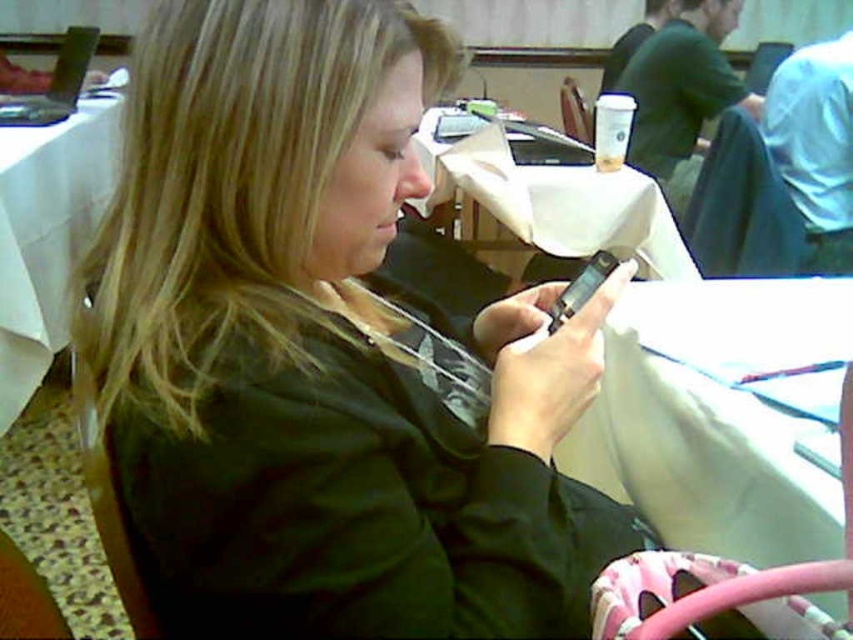
Question: Can you confirm if white cloth at left is positioned above white paper at center?

Choices:
 (A) yes
 (B) no

Answer: (B)

Question: Does matte black phone at center appear under white cloth at left?

Choices:
 (A) yes
 (B) no

Answer: (A)

Question: Which object is positioned farthest from the white fabric table at lower right?

Choices:
 (A) matte black phone at center
 (B) white paper at center
 (C) wooden chair at center
 (D) white cloth at left

Answer: (C)

Question: Can you confirm if matte black phone at center is positioned to the right of blue fabric chair at upper right?

Choices:
 (A) yes
 (B) no

Answer: (B)

Question: Which is farther from the wooden chair at center?

Choices:
 (A) white paper at center
 (B) blue fabric chair at upper right

Answer: (A)

Question: Considering the real-world distances, which object is closest to the white cloth at left?

Choices:
 (A) white paper at center
 (B) blue fabric chair at upper right
 (C) white fabric table at lower right
 (D) wooden chair at center

Answer: (A)